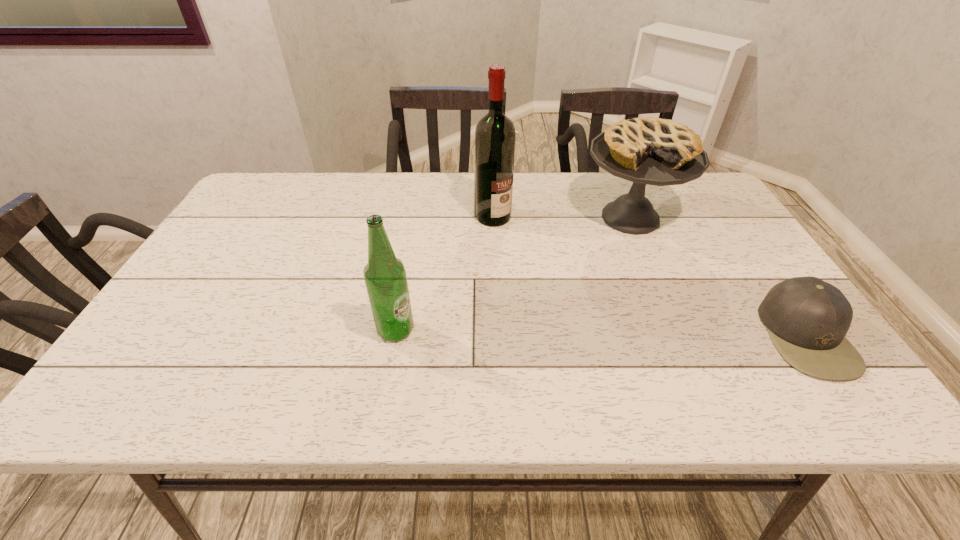
Locate an element on the screen. The image size is (960, 540). free space located on the cut side of the pie is located at coordinates (580, 341).

Find the location of a particular element. The width and height of the screenshot is (960, 540). vacant space located on the cut side of the pie is located at coordinates (603, 284).

This screenshot has height=540, width=960. I want to click on vacant space situated on the cut side of the pie, so click(x=577, y=348).

This screenshot has height=540, width=960. I want to click on blank area located 0.250m on the front and back of the second object from left to right, so click(x=564, y=274).

Where is `free region located on the front and back of the second object from left to right`? free region located on the front and back of the second object from left to right is located at coordinates (519, 238).

You are a GUI agent. You are given a task and a screenshot of the screen. Output one action in this format:
    pyautogui.click(x=<x>, y=<y>)
    Task: Click on the blank area located 0.090m on the front and back of the second object from left to right
    This screenshot has width=960, height=540.
    Given the screenshot: What is the action you would take?
    pyautogui.click(x=524, y=241)

Locate an element on the screen. pie that is at the far edge is located at coordinates (653, 151).

Identify the location of alcohol at the far edge. (495, 135).

Identify the location of beer bottle located in the near edge section of the desktop. Image resolution: width=960 pixels, height=540 pixels. (385, 277).

Locate an element on the screen. cap that is positioned at the near edge is located at coordinates (807, 318).